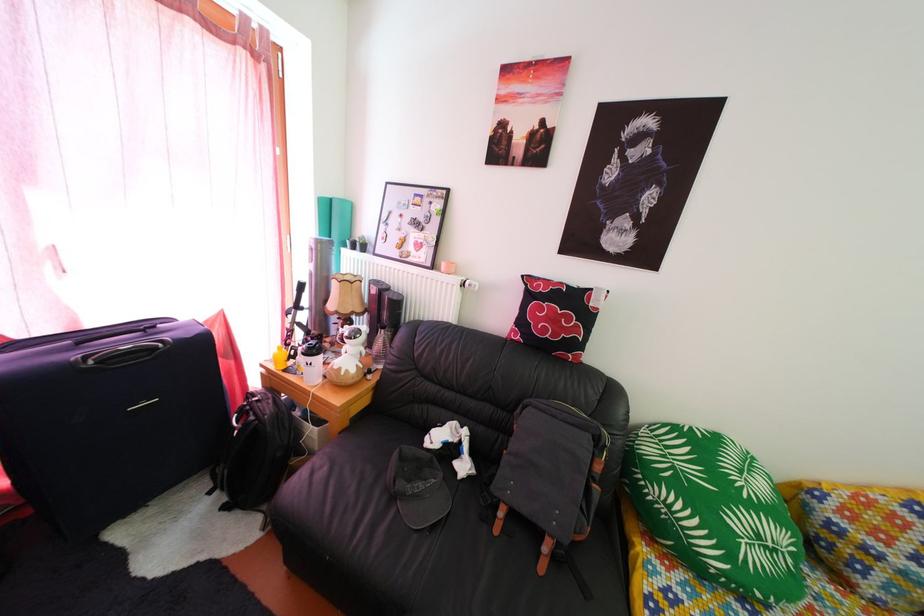
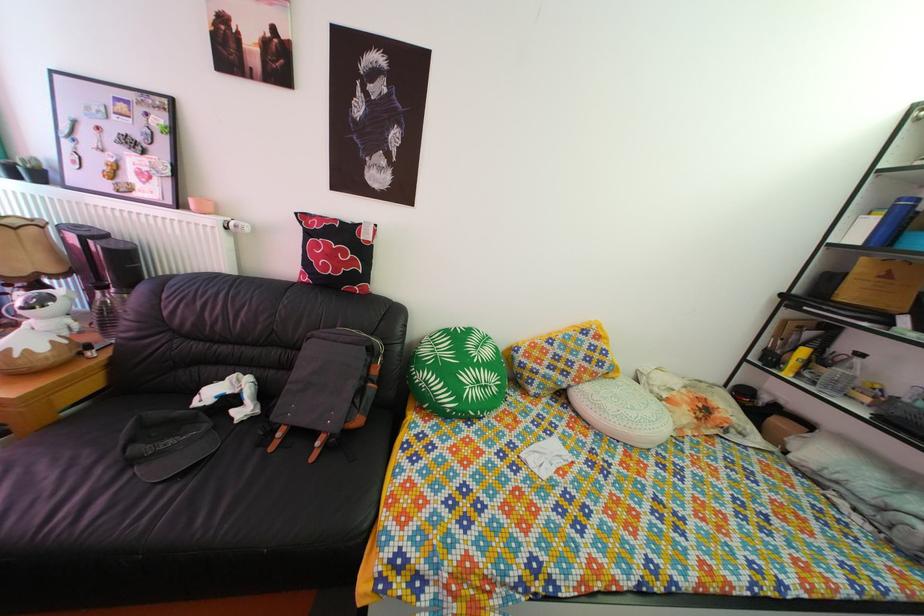
The point at (x=419, y=458) is marked in the first image. Where is the corresponding point in the second image?

(166, 422)